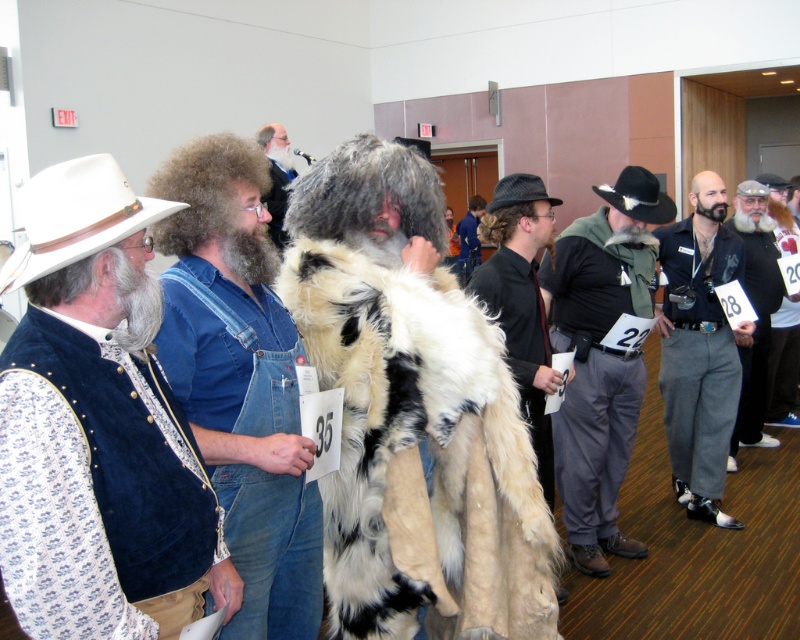
Does white fur coat at center have a lesser width compared to velvet vest at left?

No, white fur coat at center is not thinner than velvet vest at left.

Measure the distance between white fur coat at center and camera.

They are 5.98 feet apart.

Identify the location of white fur coat at center. The height and width of the screenshot is (640, 800). (408, 396).

Which is below, white fur coat at center or beige wool coat at right?

beige wool coat at right is lower down.

Which is more to the right, white fur coat at center or beige wool coat at right?

beige wool coat at right

Which is behind, point (432, 417) or point (780, 188)?

Positioned behind is point (780, 188).

You are a GUI agent. You are given a task and a screenshot of the screen. Output one action in this format:
    pyautogui.click(x=<x>, y=<y>)
    Task: Click on the white fur coat at center
    The height and width of the screenshot is (640, 800).
    Given the screenshot: What is the action you would take?
    pyautogui.click(x=408, y=396)

Is white leather cowboy hat at left bigger than black felt cowboy hat at right?

No, white leather cowboy hat at left is not bigger than black felt cowboy hat at right.

Does point (66, 189) lie behind point (662, 204)?

No, it is in front of (662, 204).

Does point (40, 268) come behind point (664, 204)?

No.

Locate an element on the screen. Image resolution: width=800 pixels, height=640 pixels. white leather cowboy hat at left is located at coordinates (76, 216).